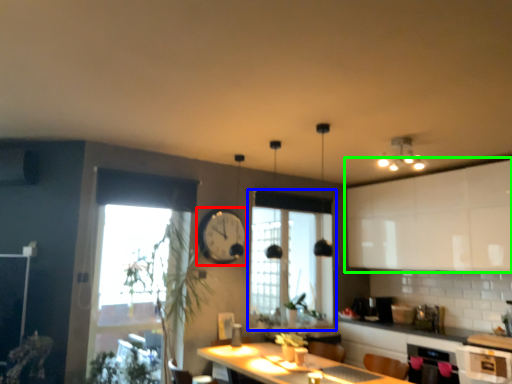
Question: Estimate the real-world distances between objects in this image. Which object is farther from clock (highlighted by a red box), window (highlighted by a blue box) or cabinetry (highlighted by a green box)?

Choices:
 (A) window
 (B) cabinetry

Answer: (B)